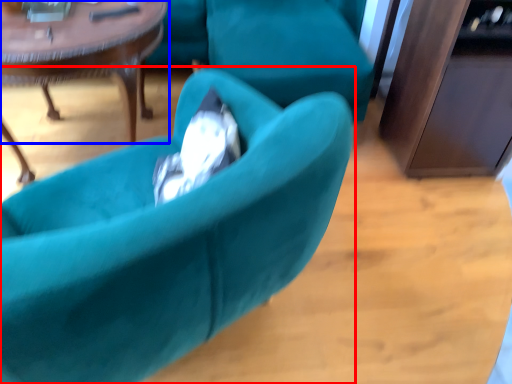
Question: Among these objects, which one is farthest to the camera, chair (highlighted by a red box) or coffee table (highlighted by a blue box)?

Choices:
 (A) chair
 (B) coffee table

Answer: (B)